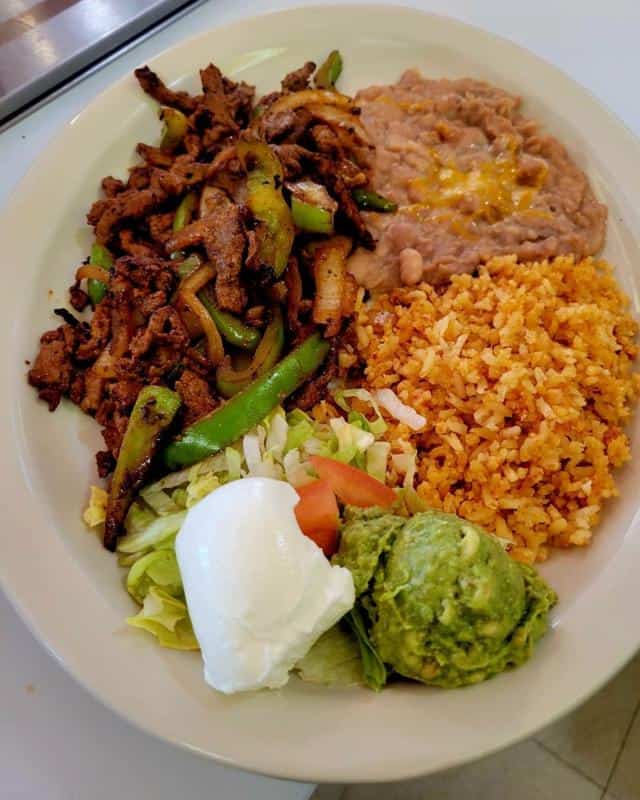
At what (x,y) coordinates should I click in order to perform the action: click on brown tiles on the floor. Please return your answer as a coordinate pair (x, y). This screenshot has height=800, width=640. Looking at the image, I should click on point(557,790), point(569,736), point(621,773).